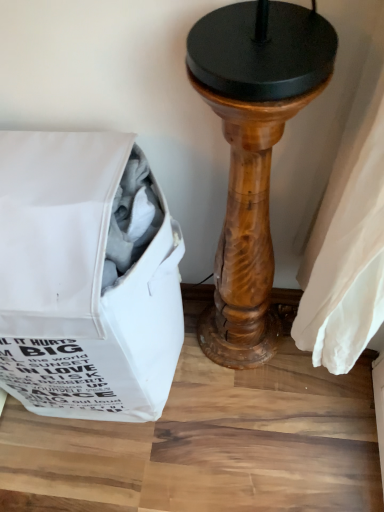
Where is `wooden pedestal at center`? This screenshot has width=384, height=512. wooden pedestal at center is located at coordinates (253, 153).

The height and width of the screenshot is (512, 384). Describe the element at coordinates (253, 153) in the screenshot. I see `wooden pedestal at center` at that location.

Locate an element on the screen. white fabric bag at left is located at coordinates (84, 279).

Describe the element at coordinates (84, 279) in the screenshot. Image resolution: width=384 pixels, height=512 pixels. I see `white fabric bag at left` at that location.

The image size is (384, 512). Identify the location of wooden pedestal at center. (253, 153).

Does white fabric bag at left appear on the left side of wooden pedestal at center?

Yes, white fabric bag at left is to the left of wooden pedestal at center.

Is white fabric bag at left closer to camera compared to wooden pedestal at center?

No.

Does point (37, 305) lie behind point (202, 30)?

Yes.

From the image's perspective, which is below, white fabric bag at left or wooden pedestal at center?

From the image's view, white fabric bag at left is below.

From a real-world perspective, which is physically below, white fabric bag at left or wooden pedestal at center?

From a 3D spatial view, white fabric bag at left is below.

Between white fabric bag at left and wooden pedestal at center, which one has larger width?

white fabric bag at left.

Considering the sizes of white fabric bag at left and wooden pedestal at center in the image, is white fabric bag at left taller or shorter than wooden pedestal at center?

Clearly, white fabric bag at left is shorter compared to wooden pedestal at center.

Is white fabric bag at left bigger than wooden pedestal at center?

Indeed, white fabric bag at left has a larger size compared to wooden pedestal at center.

Is wooden pedestal at center located within white fabric bag at left?

That's incorrect, wooden pedestal at center is not inside white fabric bag at left.

Is white fabric bag at left next to wooden pedestal at center and touching it?

No, white fabric bag at left is not making contact with wooden pedestal at center.

Is white fabric bag at left facing towards wooden pedestal at center?

No, white fabric bag at left does not turn towards wooden pedestal at center.

Where is `bag that is behind the wooden pedestal at center`? The width and height of the screenshot is (384, 512). bag that is behind the wooden pedestal at center is located at coordinates (84, 279).

Can you confirm if wooden pedestal at center is positioned to the left of white fabric bag at left?

No.

Considering the relative positions of wooden pedestal at center and white fabric bag at left in the image provided, is wooden pedestal at center in front of white fabric bag at left?

Yes, wooden pedestal at center is closer to the viewer.

Is point (269, 262) farther from viewer compared to point (161, 331)?

That is True.

From the image's perspective, which is below, wooden pedestal at center or white fabric bag at left?

From the image's view, white fabric bag at left is below.

From a real-world perspective, between wooden pedestal at center and white fabric bag at left, who is vertically higher?

From a 3D spatial view, wooden pedestal at center is above.

Does wooden pedestal at center have a greater width compared to white fabric bag at left?

No, wooden pedestal at center is not wider than white fabric bag at left.

Who is taller, wooden pedestal at center or white fabric bag at left?

Standing taller between the two is wooden pedestal at center.

Is wooden pedestal at center bigger than white fabric bag at left?

Incorrect, wooden pedestal at center is not larger than white fabric bag at left.

Looking at this image, is wooden pedestal at center positioned beyond the bounds of white fabric bag at left?

Yes, wooden pedestal at center is not within white fabric bag at left.

Is wooden pedestal at center next to white fabric bag at left?

wooden pedestal at center and white fabric bag at left are clearly separated.

Is white fabric bag at left at the back of wooden pedestal at center?

That's not correct — wooden pedestal at center is not looking away from white fabric bag at left.

What's the angular difference between wooden pedestal at center and white fabric bag at left's facing directions?

0.000427 degrees separate the facing orientations of wooden pedestal at center and white fabric bag at left.

The image size is (384, 512). Identify the location of furniture above the white fabric bag at left (from a real-world perspective). (253, 153).

Where is `bag lying behind the wooden pedestal at center`? This screenshot has width=384, height=512. bag lying behind the wooden pedestal at center is located at coordinates (84, 279).

Where is `furniture located above the white fabric bag at left (from a real-world perspective)`? furniture located above the white fabric bag at left (from a real-world perspective) is located at coordinates (253, 153).